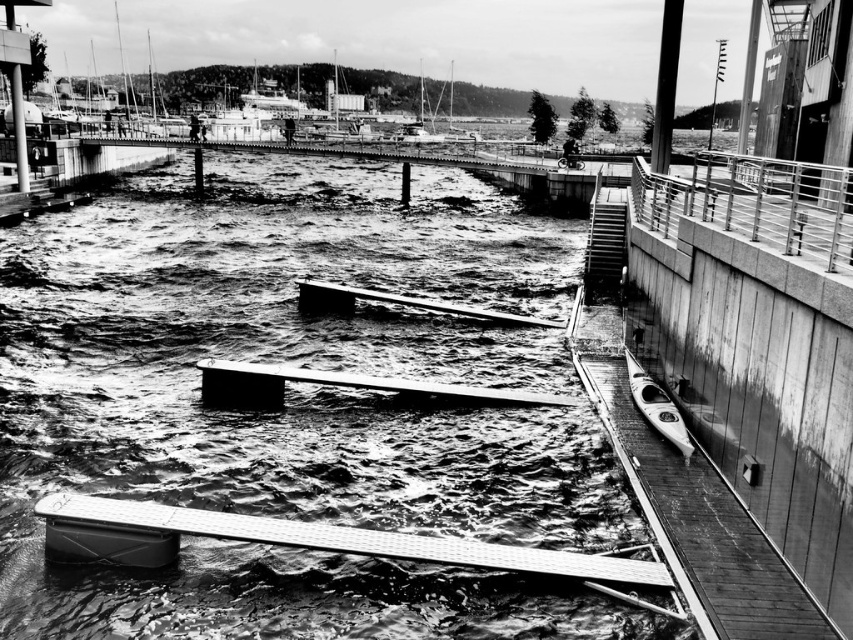
Question: Can you confirm if rough water at center is wider than smooth gray dock at center?

Choices:
 (A) no
 (B) yes

Answer: (B)

Question: Which of the following is the farthest from the observer?

Choices:
 (A) rough water at center
 (B) metallic silver railing at upper right

Answer: (B)

Question: Is rough water at center bigger than metallic silver railing at upper right?

Choices:
 (A) no
 (B) yes

Answer: (A)

Question: Which is farther from the white glossy kayak at lower right?

Choices:
 (A) rough water at center
 (B) metallic silver railing at upper right

Answer: (A)

Question: Does rough water at center have a smaller size compared to metallic silver railing at upper right?

Choices:
 (A) no
 (B) yes

Answer: (B)

Question: Which of these objects is positioned closest to the smooth gray dock at center?

Choices:
 (A) metallic silver railing at upper right
 (B) white glossy kayak at lower right

Answer: (B)